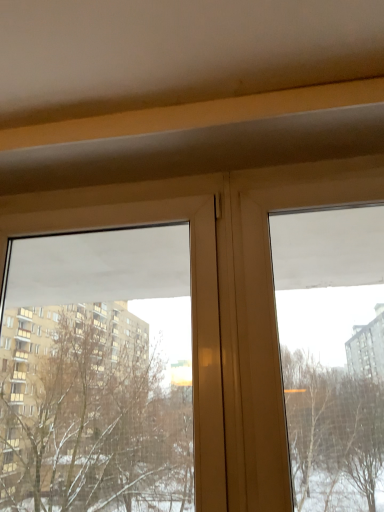
What is the approximate height of transparent plastic window screen at upper right?

transparent plastic window screen at upper right is 3.28 feet in height.

The image size is (384, 512). I want to click on transparent plastic window screen at upper right, so point(332,353).

Describe the element at coordinates (332, 353) in the screenshot. I see `transparent plastic window screen at upper right` at that location.

Image resolution: width=384 pixels, height=512 pixels. What are the coordinates of `transparent plastic window screen at upper right` in the screenshot? It's located at (332, 353).